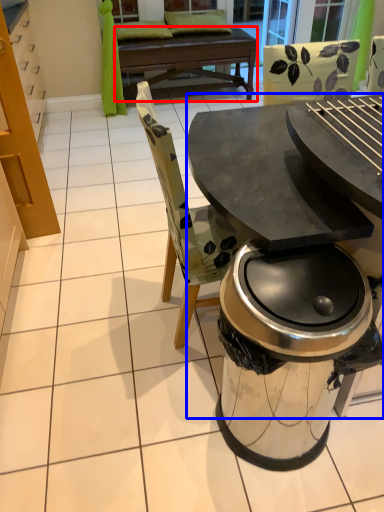
Question: Among these objects, which one is nearest to the camera, round table (highlighted by a red box) or table (highlighted by a blue box)?

Choices:
 (A) round table
 (B) table

Answer: (B)